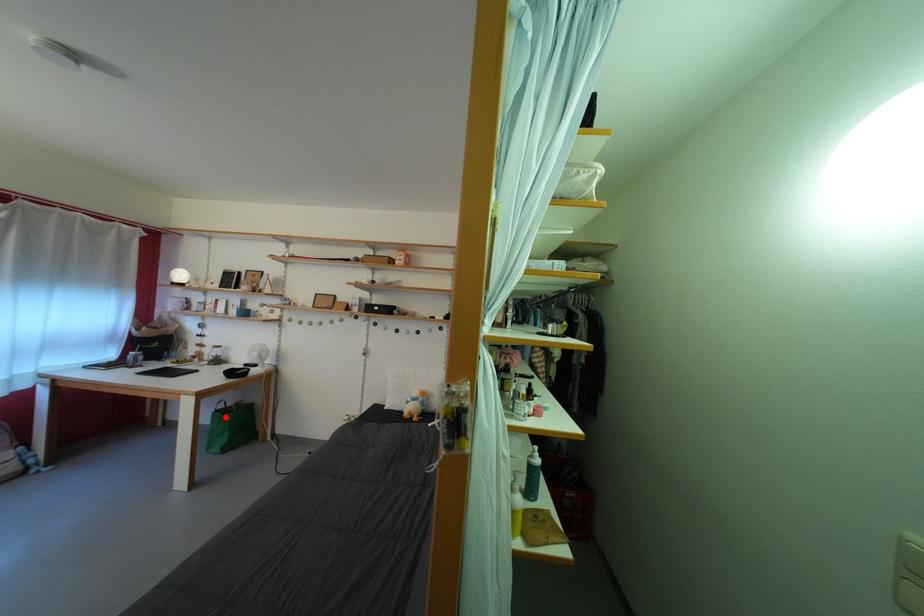
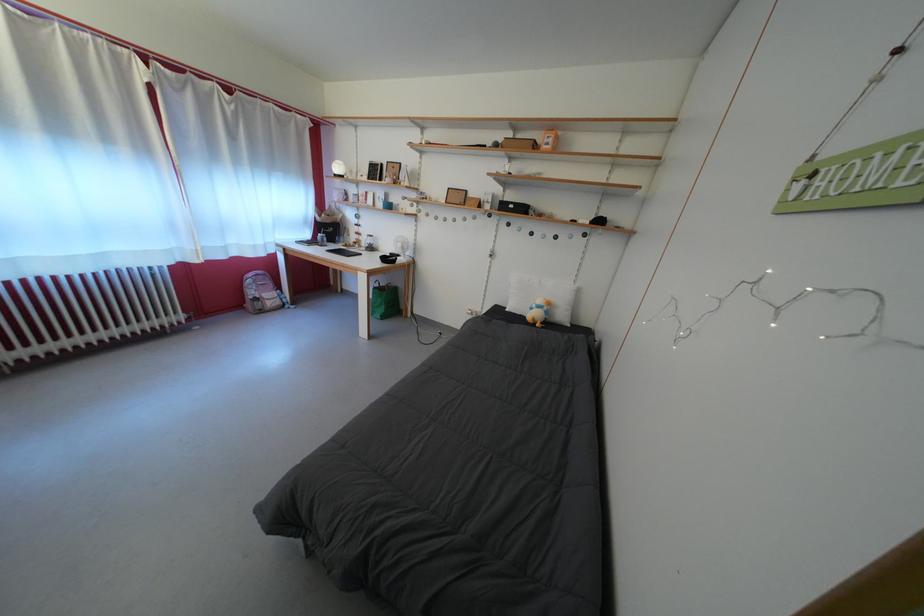
Locate, in the second image, the point that corresponds to the highlighted location in the first image.

(383, 294)